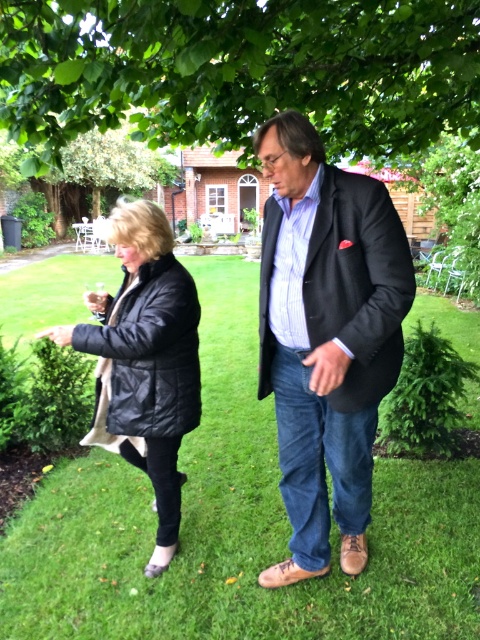
In the scene shown: Is green leafy tree at upper center to the left of matte black blazer at center from the viewer's perspective?

No, green leafy tree at upper center is not to the left of matte black blazer at center.

Does point (144, 42) come in front of point (308, 576)?

That is False.

Locate an element on the screen. green leafy tree at upper center is located at coordinates (240, 70).

Locate an element on the screen. green leafy tree at upper center is located at coordinates (240, 70).

Is green leafy tree at upper center smaller than black leather jacket at center?

Actually, green leafy tree at upper center might be larger than black leather jacket at center.

Locate an element on the screen. green leafy tree at upper center is located at coordinates (240, 70).

Locate an element on the screen. This screenshot has width=480, height=640. green leafy tree at upper center is located at coordinates (240, 70).

Is matte black blazer at center to the right of black quilted jacket at left from the viewer's perspective?

Correct, you'll find matte black blazer at center to the right of black quilted jacket at left.

What do you see at coordinates (325, 337) in the screenshot?
I see `matte black blazer at center` at bounding box center [325, 337].

The width and height of the screenshot is (480, 640). Find the location of `matte black blazer at center`. matte black blazer at center is located at coordinates (325, 337).

Identify the location of matte black blazer at center. (325, 337).